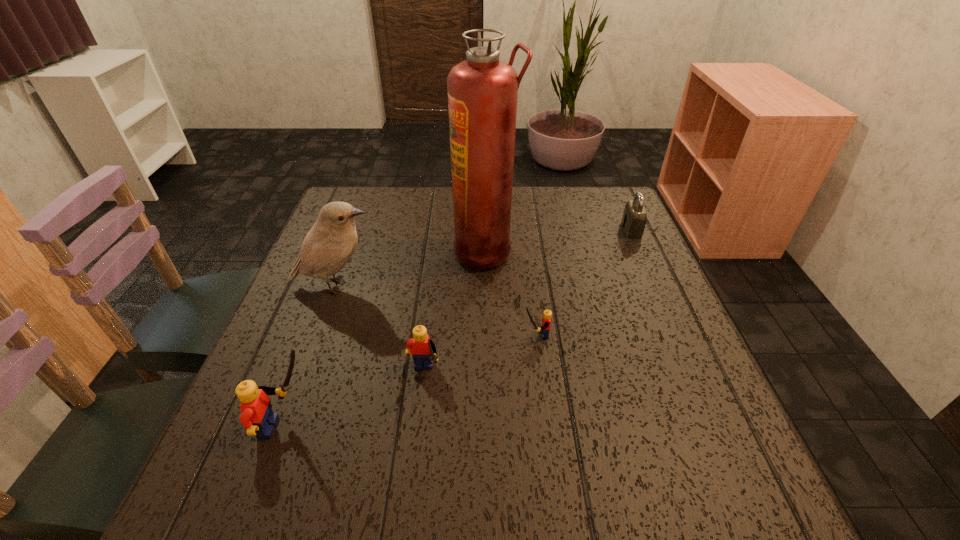
Please point a spot on the right to add another Lego. Please provide its 2D coordinates. Your answer should be formatted as a tuple, i.e. [(x, y)], where the tuple contains the x and y coordinates of a point satisfying the conditions above.

[(631, 300)]